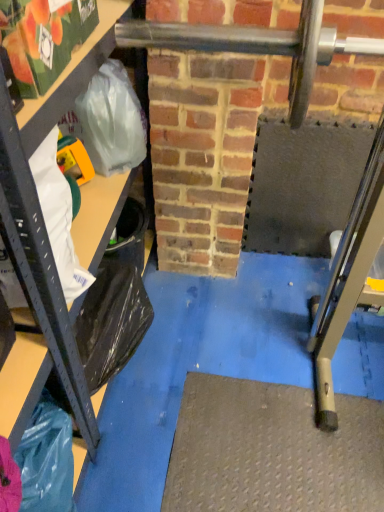
What are the coordinates of `metallic gray shelf at left` in the screenshot? It's located at (75, 73).

Describe the element at coordinates (75, 73) in the screenshot. I see `metallic gray shelf at left` at that location.

What is the approximate height of white plastic grocery bag at left?

The height of white plastic grocery bag at left is 13.17 inches.

Locate an element on the screen. This screenshot has height=512, width=384. white plastic grocery bag at left is located at coordinates (x=59, y=215).

What do you see at coordinates (59, 215) in the screenshot? I see `white plastic grocery bag at left` at bounding box center [59, 215].

Locate an element on the screen. The image size is (384, 512). metallic gray shelf at left is located at coordinates (75, 73).

Which object is positioned more to the left, metallic gray shelf at left or white plastic grocery bag at left?

metallic gray shelf at left is more to the left.

Which is behind, metallic gray shelf at left or white plastic grocery bag at left?

A: Positioned behind is white plastic grocery bag at left.

Which point is more distant from viewer, [0,378] or [59,168]?

Positioned behind is point [59,168].

From the image's perspective, which object appears higher, metallic gray shelf at left or white plastic grocery bag at left?

metallic gray shelf at left.

From a real-world perspective, is metallic gray shelf at left located higher than white plastic grocery bag at left?

No.

In terms of width, does metallic gray shelf at left look wider or thinner when compared to white plastic grocery bag at left?

In the image, metallic gray shelf at left appears to be wider than white plastic grocery bag at left.

Considering the relative sizes of metallic gray shelf at left and white plastic grocery bag at left in the image provided, is metallic gray shelf at left taller than white plastic grocery bag at left?

Indeed, metallic gray shelf at left has a greater height compared to white plastic grocery bag at left.

Who is bigger, metallic gray shelf at left or white plastic grocery bag at left?

With larger size is metallic gray shelf at left.

Is white plastic grocery bag at left surrounded by metallic gray shelf at left?

Yes, white plastic grocery bag at left is a part of metallic gray shelf at left.

Is metallic gray shelf at left far away from white plastic grocery bag at left?

metallic gray shelf at left is near white plastic grocery bag at left, not far away.

Is metallic gray shelf at left facing away from white plastic grocery bag at left?

No.

How many degrees apart are the facing directions of metallic gray shelf at left and white plastic grocery bag at left?

There is a 1.56-degree angle between the facing directions of metallic gray shelf at left and white plastic grocery bag at left.

Identify the location of shelf lying on the left of white plastic grocery bag at left. This screenshot has height=512, width=384. (75, 73).

Can you confirm if white plastic grocery bag at left is positioned to the right of metallic gray shelf at left?

Yes.

Which is in front, white plastic grocery bag at left or metallic gray shelf at left?

metallic gray shelf at left is in front.

Looking at this image, which is more distant, [63,283] or [31,207]?

The point [63,283] is behind.

From the image's perspective, who appears lower, white plastic grocery bag at left or metallic gray shelf at left?

white plastic grocery bag at left is shown below in the image.

From a real-world perspective, which is physically below, white plastic grocery bag at left or metallic gray shelf at left?

metallic gray shelf at left.

Is white plastic grocery bag at left wider than metallic gray shelf at left?

In fact, white plastic grocery bag at left might be narrower than metallic gray shelf at left.

Considering the sizes of white plastic grocery bag at left and metallic gray shelf at left in the image, is white plastic grocery bag at left taller or shorter than metallic gray shelf at left?

In the image, white plastic grocery bag at left appears to be shorter than metallic gray shelf at left.

Between white plastic grocery bag at left and metallic gray shelf at left, which one has smaller size?

white plastic grocery bag at left is smaller.

Is white plastic grocery bag at left inside the boundaries of metallic gray shelf at left, or outside?

white plastic grocery bag at left exists entirely within metallic gray shelf at left.

Are white plastic grocery bag at left and metallic gray shelf at left beside each other?

No, white plastic grocery bag at left is not touching metallic gray shelf at left.

Could you tell me if white plastic grocery bag at left is turned towards metallic gray shelf at left?

Yes, white plastic grocery bag at left is turned towards metallic gray shelf at left.

What's the angular difference between white plastic grocery bag at left and metallic gray shelf at left's facing directions?

The facing directions of white plastic grocery bag at left and metallic gray shelf at left are 1.56 degrees apart.

The height and width of the screenshot is (512, 384). What are the coordinates of `shelf located on the left of white plastic grocery bag at left` in the screenshot? It's located at (75, 73).

At what (x,y) coordinates should I click in order to perform the action: click on shelf in front of the white plastic grocery bag at left. Please return your answer as a coordinate pair (x, y). Looking at the image, I should click on (75, 73).

Identify the location of grocery bag lying behind the metallic gray shelf at left. The image size is (384, 512). (59, 215).